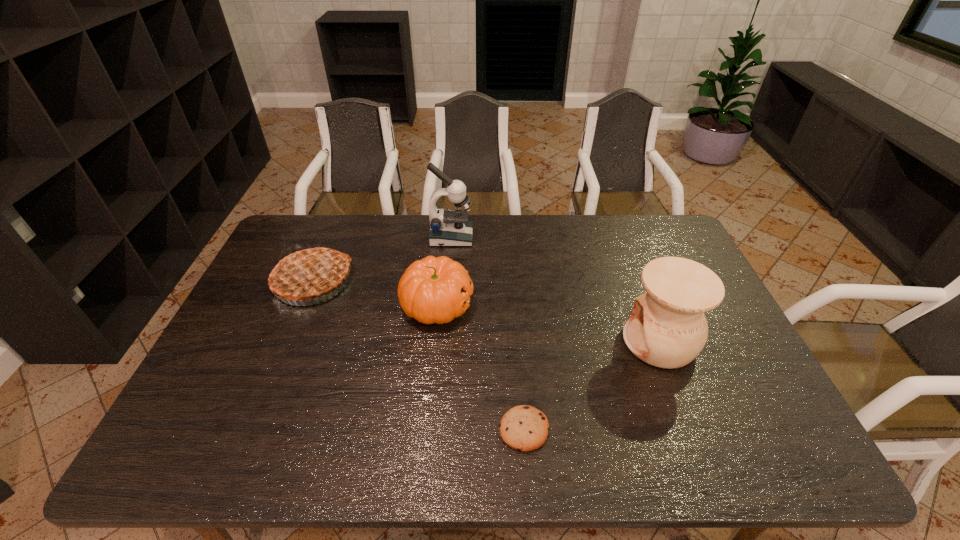
At what (x,y) coordinates should I click in order to perform the action: click on free space at the far edge. Please return your answer as a coordinate pair (x, y). This screenshot has width=960, height=540. Looking at the image, I should click on (492, 221).

Image resolution: width=960 pixels, height=540 pixels. What are the coordinates of `vacant space at the near edge of the desktop` in the screenshot? It's located at (419, 442).

I want to click on vacant space at the left edge of the desktop, so click(217, 363).

At what (x,y) coordinates should I click in order to perform the action: click on vacant space at the far right corner. Please return your answer as a coordinate pair (x, y). Looking at the image, I should click on (647, 215).

Image resolution: width=960 pixels, height=540 pixels. Find the location of `vacant region at the near right corner`. vacant region at the near right corner is located at coordinates (798, 464).

What are the coordinates of `blank region between the second object from right to left and the microscope` in the screenshot? It's located at (488, 333).

The image size is (960, 540). I want to click on free space between the pumpkin and the fourth shortest object, so click(548, 323).

What are the coordinates of `empty space between the leftmost object and the fourth object from left to right` in the screenshot? It's located at (419, 355).

Where is `free space that is in between the farthest object and the leftmost object`? The width and height of the screenshot is (960, 540). free space that is in between the farthest object and the leftmost object is located at coordinates (382, 259).

Identify the location of vacant area between the pottery and the pie. This screenshot has height=540, width=960. (487, 311).